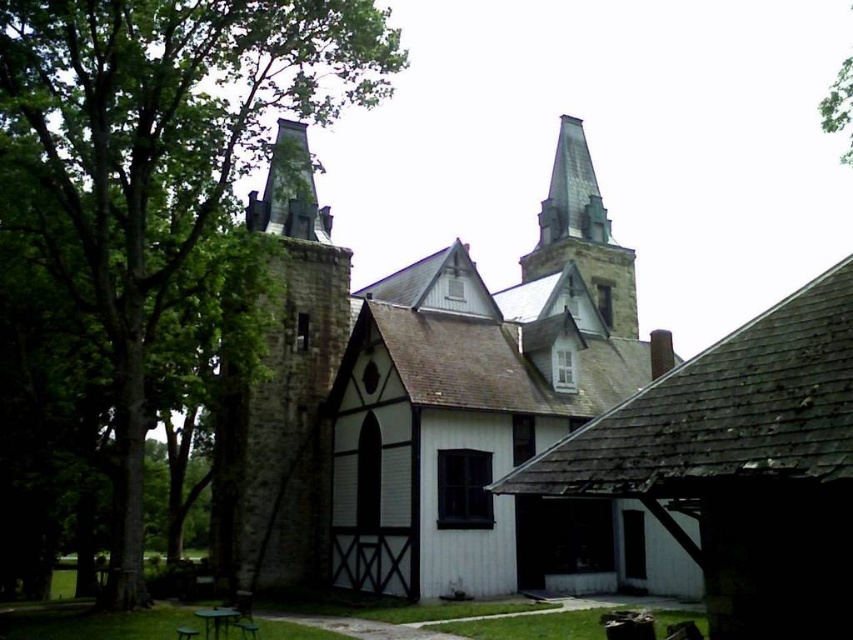
Does point (123, 440) lie in front of point (561, 120)?

Yes, point (123, 440) is in front of point (561, 120).

Does green leafy tree at left have a smaller size compared to gray stone steeple at upper center?

No.

Is point (83, 168) in front of point (599, 195)?

Yes, it is in front of point (599, 195).

Where is `green leafy tree at left`? The width and height of the screenshot is (853, 640). green leafy tree at left is located at coordinates point(161,150).

Between stone church at center and gray stone steeple at upper center, which one is positioned lower?

stone church at center

Describe the element at coordinates (444, 406) in the screenshot. I see `stone church at center` at that location.

The width and height of the screenshot is (853, 640). Find the location of `stone church at center`. stone church at center is located at coordinates (444, 406).

Is stone church at center shorter than green leafy tree at left?

Indeed, stone church at center has a lesser height compared to green leafy tree at left.

Image resolution: width=853 pixels, height=640 pixels. Describe the element at coordinates (444, 406) in the screenshot. I see `stone church at center` at that location.

Which is behind, point (526, 428) or point (144, 257)?

The point (526, 428) is more distant.

This screenshot has width=853, height=640. I want to click on stone church at center, so pyautogui.click(x=444, y=406).